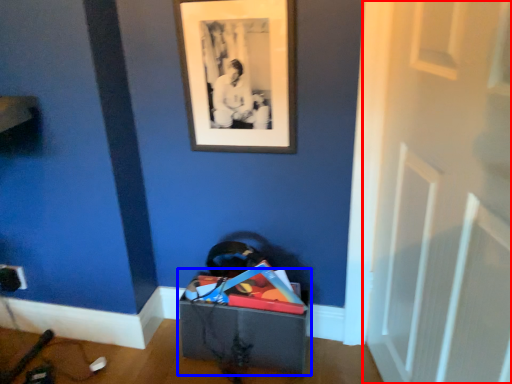
Question: Among these objects, which one is farthest to the camera, door (highlighted by a red box) or storage box (highlighted by a blue box)?

Choices:
 (A) door
 (B) storage box

Answer: (B)